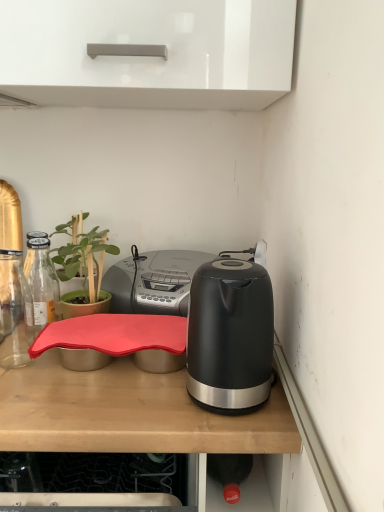
Question: Considering the relative positions of matte black kettle at right and rubberized red tray at center in the image provided, is matte black kettle at right behind rubberized red tray at center?

Choices:
 (A) yes
 (B) no

Answer: (A)

Question: Is matte black kettle at right to the left of rubberized red tray at center from the viewer's perspective?

Choices:
 (A) no
 (B) yes

Answer: (A)

Question: Is matte black kettle at right aimed at rubberized red tray at center?

Choices:
 (A) no
 (B) yes

Answer: (A)

Question: Considering the relative sizes of matte black kettle at right and rubberized red tray at center in the image provided, is matte black kettle at right shorter than rubberized red tray at center?

Choices:
 (A) yes
 (B) no

Answer: (A)

Question: Is matte black kettle at right thinner than rubberized red tray at center?

Choices:
 (A) no
 (B) yes

Answer: (B)

Question: Does matte black kettle at right have a smaller size compared to rubberized red tray at center?

Choices:
 (A) no
 (B) yes

Answer: (B)

Question: Is green matte plant at left wider than rubberized red tray at center?

Choices:
 (A) yes
 (B) no

Answer: (B)

Question: Does green matte plant at left touch rubberized red tray at center?

Choices:
 (A) no
 (B) yes

Answer: (A)

Question: Is rubberized red tray at center surrounded by green matte plant at left?

Choices:
 (A) yes
 (B) no

Answer: (B)

Question: Is rubberized red tray at center at the back of green matte plant at left?

Choices:
 (A) yes
 (B) no

Answer: (B)

Question: From the image's perspective, is green matte plant at left beneath rubberized red tray at center?

Choices:
 (A) no
 (B) yes

Answer: (A)

Question: Can you confirm if green matte plant at left is shorter than rubberized red tray at center?

Choices:
 (A) yes
 (B) no

Answer: (A)

Question: Considering the relative positions of black glossy kettle at right and rubberized red tray at center in the image provided, is black glossy kettle at right behind rubberized red tray at center?

Choices:
 (A) no
 (B) yes

Answer: (B)